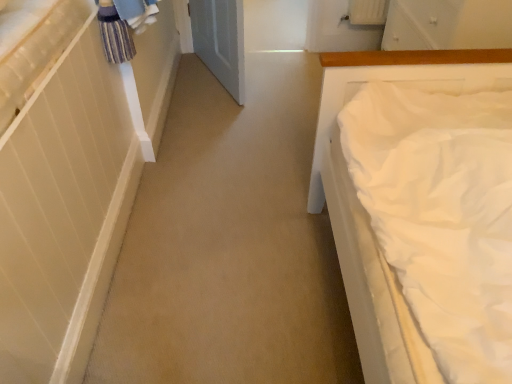
The width and height of the screenshot is (512, 384). Describe the element at coordinates (365, 211) in the screenshot. I see `white smooth bed at right` at that location.

The height and width of the screenshot is (384, 512). Identify the location of white smooth bed at right. (365, 211).

Where is `white smooth bed at right`? This screenshot has height=384, width=512. white smooth bed at right is located at coordinates (365, 211).